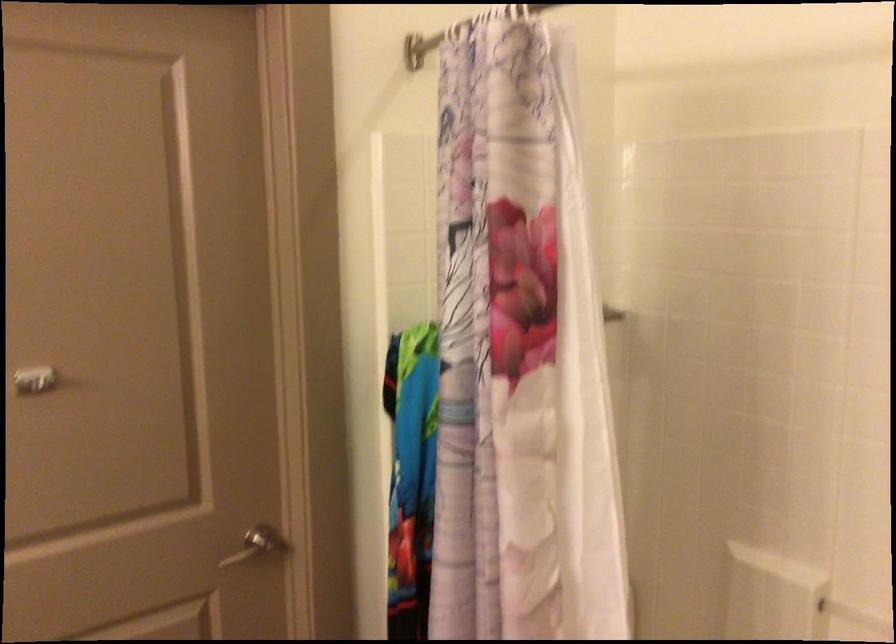
Find the location of `silver door handle`. silver door handle is located at coordinates (257, 545).